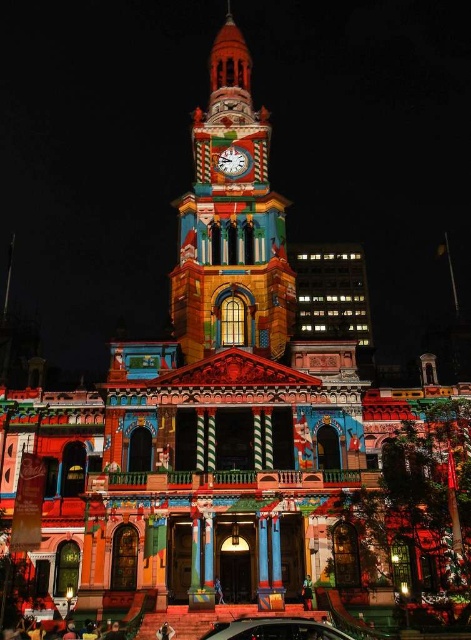
Is multicolored mosaic clock tower at center to the left of metallic silver car at lower center from the viewer's perspective?

Indeed, multicolored mosaic clock tower at center is positioned on the left side of metallic silver car at lower center.

Is multicolored mosaic clock tower at center thinner than metallic silver car at lower center?

No.

Is point (199, 131) farther from viewer compared to point (301, 625)?

Yes, point (199, 131) is farther from viewer.

At what (x,y) coordinates should I click in order to perform the action: click on multicolored mosaic clock tower at center. Please return your answer as a coordinate pair (x, y). The height and width of the screenshot is (640, 471). Looking at the image, I should click on (230, 225).

Which is below, metallic silver car at lower center or metallic silver clock at center?

metallic silver car at lower center is lower down.

Find the location of a particular element. The height and width of the screenshot is (640, 471). metallic silver car at lower center is located at coordinates (274, 628).

Is multicolored mosaic clock tower at center to the left of metallic silver clock at center from the viewer's perspective?

Yes, multicolored mosaic clock tower at center is to the left of metallic silver clock at center.

Can you confirm if multicolored mosaic clock tower at center is shorter than metallic silver clock at center?

No.

Which is in front, point (209, 262) or point (244, 157)?

Point (209, 262) is in front.

Locate an element on the screen. The image size is (471, 640). multicolored mosaic clock tower at center is located at coordinates (230, 225).